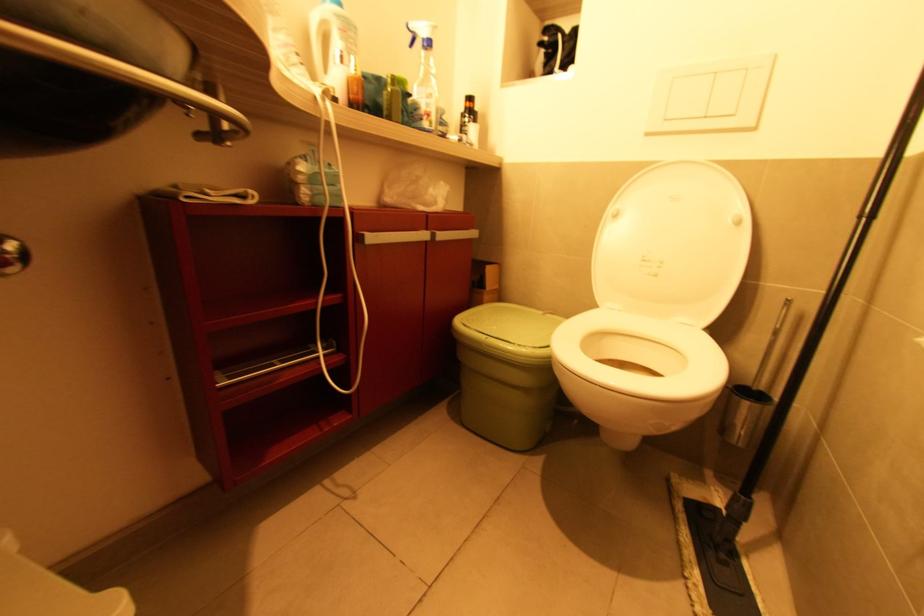
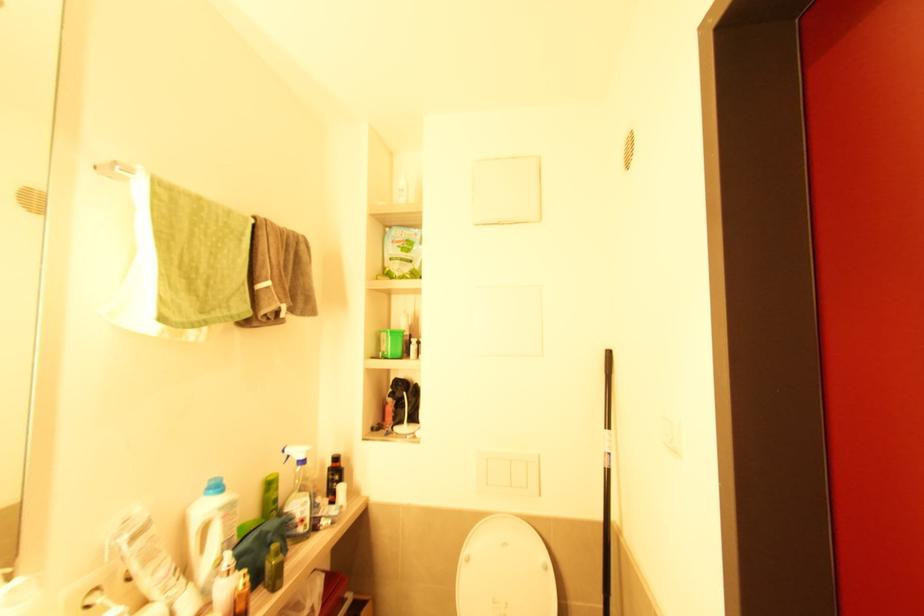
Locate, in the second image, the point that corresponds to point 424,121 in the first image.

(298, 527)